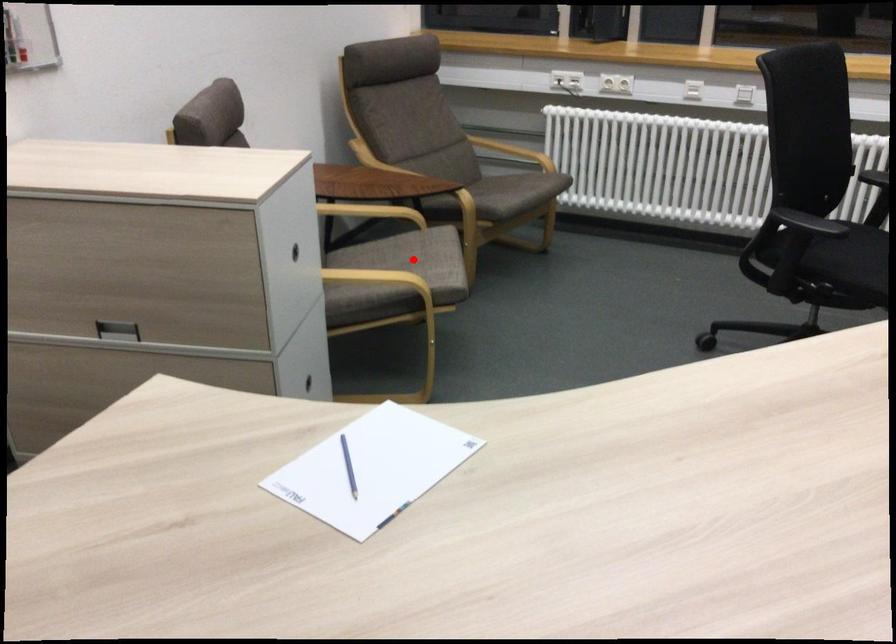
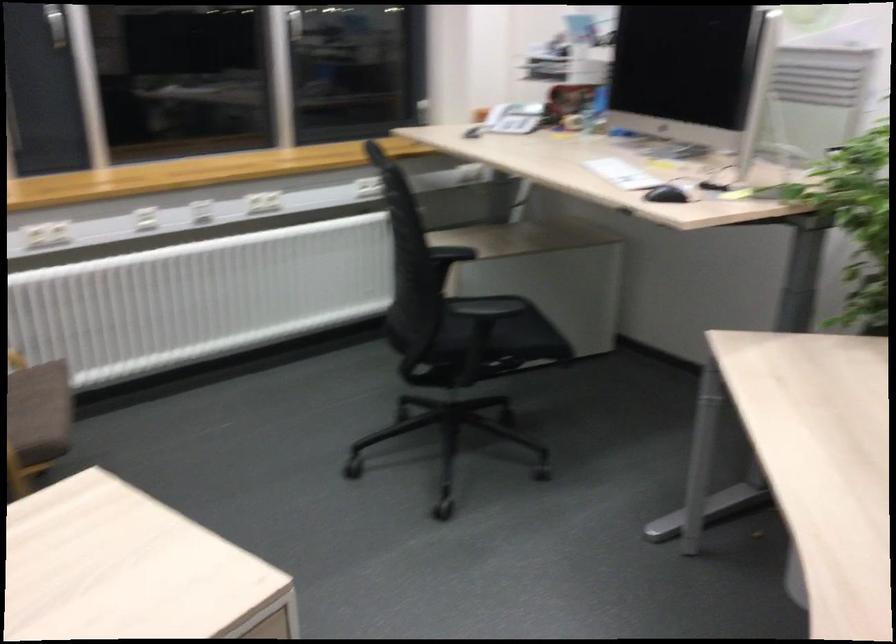
Question: I am providing you with two images of the same scene from different viewpoints. A red point is marked on the first image. At the location where the point appears in image 1, is it still visible in image 2?

Choices:
 (A) Yes
 (B) No

Answer: (B)